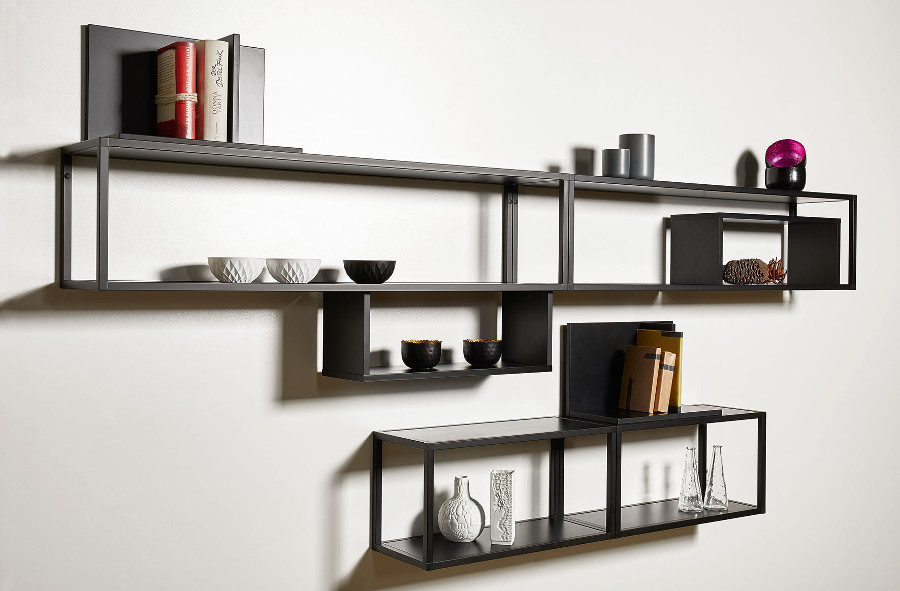
Identify the location of books on shelf. Image resolution: width=900 pixels, height=591 pixels. (191, 95), (210, 86), (234, 92), (648, 396), (658, 395), (668, 381), (679, 371).